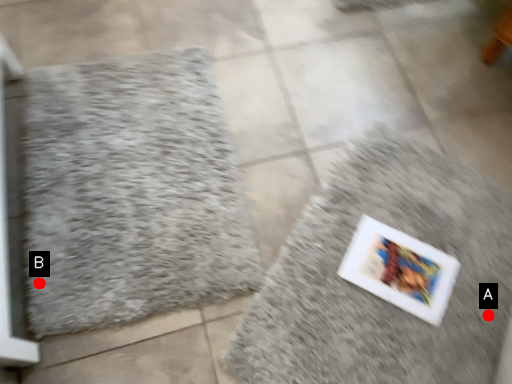
Question: Two points are circled on the image, labeled by A and B beside each circle. Which point is closer to the camera?

Choices:
 (A) A is closer
 (B) B is closer

Answer: (B)